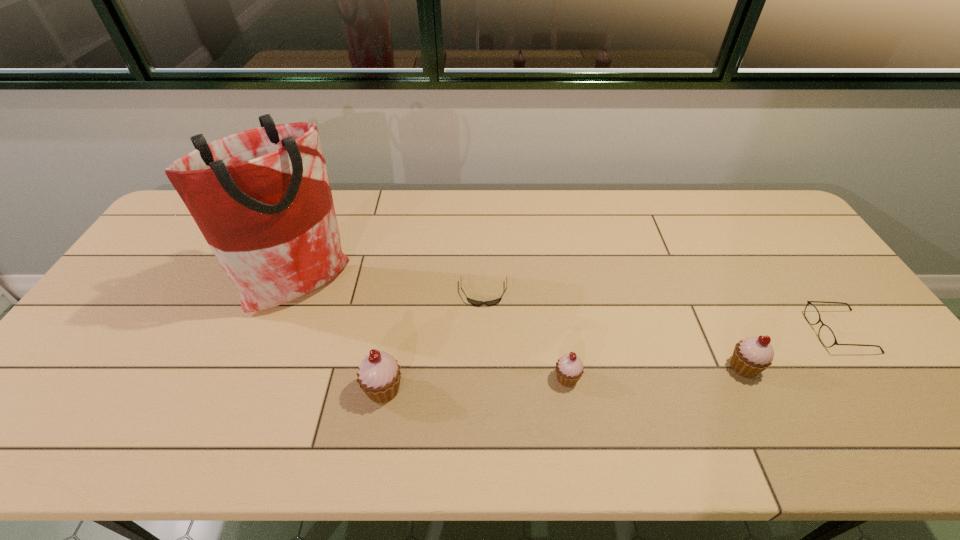
The width and height of the screenshot is (960, 540). What are the coordinates of `spectacles` in the screenshot? It's located at (826, 336).

This screenshot has height=540, width=960. I want to click on the fifth tallest object, so click(x=826, y=336).

Identify the location of free region located 0.290m on the right of the tallest cupcake. (526, 389).

This screenshot has height=540, width=960. What are the coordinates of `free space located on the back of the second cupcake from right to left` in the screenshot? It's located at (557, 310).

Locate an element on the screen. This screenshot has width=960, height=540. blank area located 0.060m on the right of the fifth object from left to right is located at coordinates (785, 367).

Where is `blank area located 0.220m on the left of the leftmost object`? blank area located 0.220m on the left of the leftmost object is located at coordinates (184, 288).

The width and height of the screenshot is (960, 540). In order to click on vacant space situated on the front-facing side of the sunglasses in this screenshot , I will do `click(485, 387)`.

Locate an element on the screen. free space located on the front-facing side of the rightmost object is located at coordinates (682, 332).

Identify the location of vacant position located on the front-facing side of the rightmost object. (674, 332).

The height and width of the screenshot is (540, 960). In order to click on vacant space positioned 0.160m on the front-facing side of the rightmost object in this screenshot , I will do click(x=753, y=332).